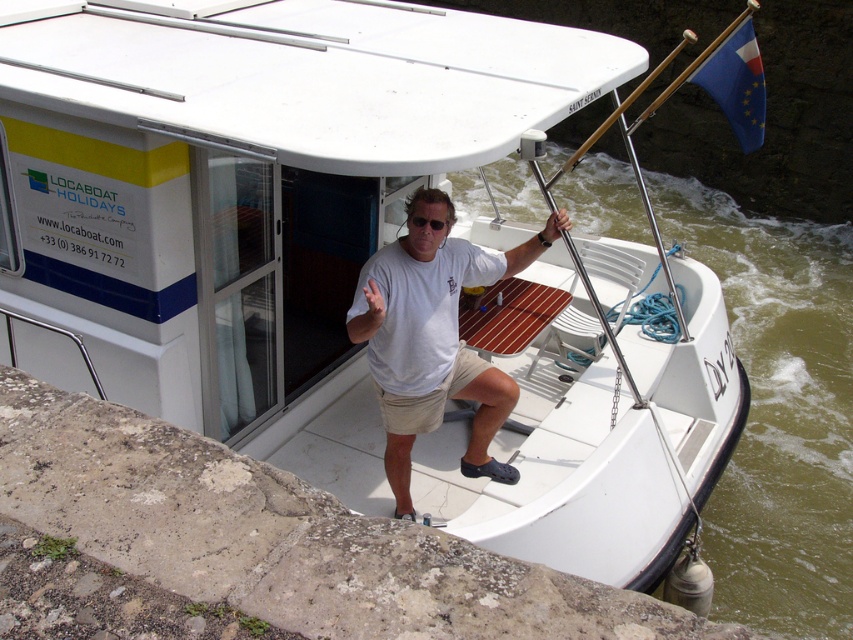
You are standing on the deck of the houseboat and want to throw a ball from the white cotton shirt at center to the green water at lower right. If the ball travels in a straight line, how far will it have to travel?

The green water at lower right is 4.03 meters from the white cotton shirt at center, so the ball will have to travel 4.03 meters in a straight line.

From the picture: You are standing on the deck of the houseboat and want to know which object is taller between the green water at lower right and the white cotton shirt at center. Can you tell me?

The green water at lower right has a greater height compared to the white cotton shirt at center, so the green water at lower right is taller.

You are a photographer taking a picture of the scene. You need to include both the stone textured ledge at lower left and the white cotton shirt at center. Which object should you position on the left side of your frame?

The stone textured ledge at lower left should be positioned on the left side of your frame because it is located to the left of the white cotton shirt at center.